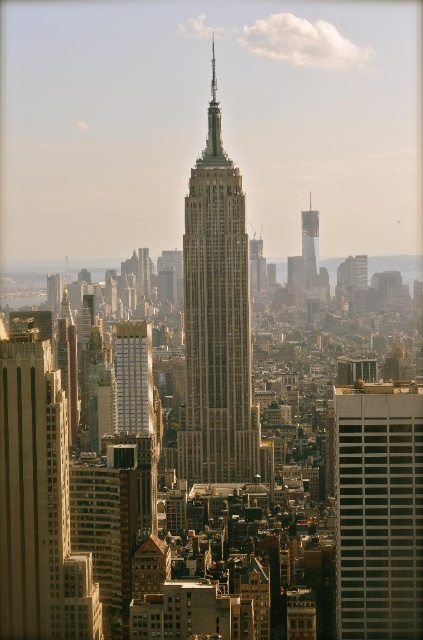
Question: Which point is farther to the camera?

Choices:
 (A) smooth concrete skyscraper at center
 (B) gray concrete building at right
 (C) beige stone tower at center

Answer: (B)

Question: Does gray concrete building at right appear over smooth concrete skyscraper at center?

Choices:
 (A) yes
 (B) no

Answer: (B)

Question: Which of the following is the closest to the observer?

Choices:
 (A) gray concrete building at right
 (B) smooth concrete skyscraper at center
 (C) beige stone tower at center

Answer: (C)

Question: Which point appears farthest from the camera in this image?

Choices:
 (A) (213, 93)
 (B) (312, 214)

Answer: (A)

Question: Is beige stone tower at center closer to camera compared to smooth concrete skyscraper at center?

Choices:
 (A) yes
 (B) no

Answer: (A)

Question: Is beige stone tower at center thinner than gray concrete building at right?

Choices:
 (A) yes
 (B) no

Answer: (A)